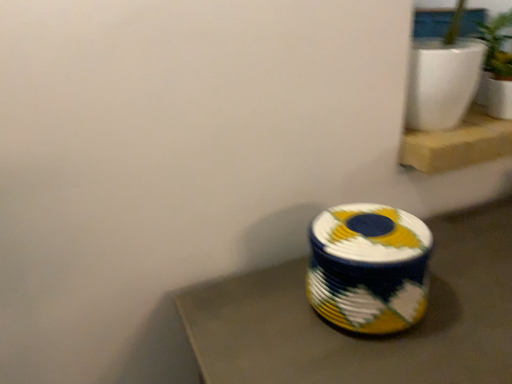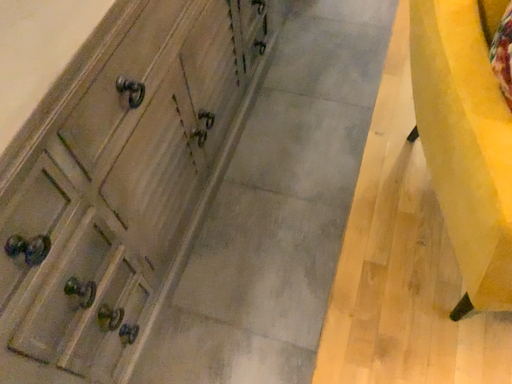
Question: Which way did the camera rotate in the video?

Choices:
 (A) rotated upward
 (B) rotated downward

Answer: (B)